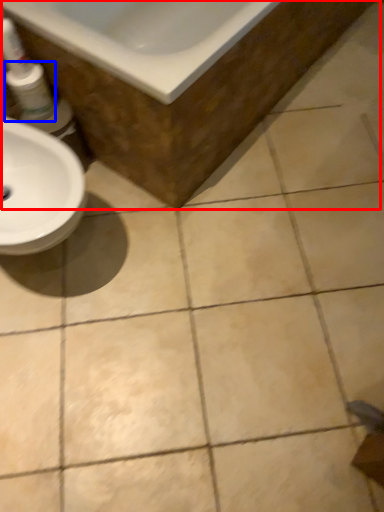
Question: Which point is closer to the camera, bath (highlighted by a red box) or mouthwash (highlighted by a blue box)?

Choices:
 (A) bath
 (B) mouthwash

Answer: (A)